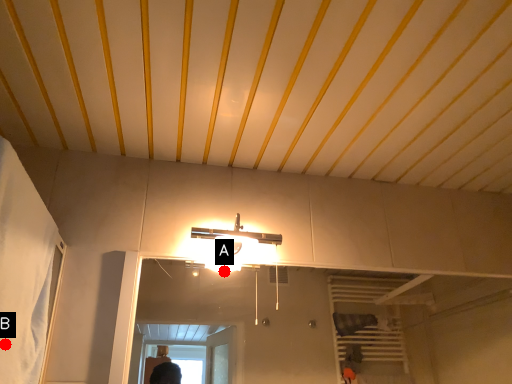
Question: Two points are circled on the image, labeled by A and B beside each circle. Which point is farther from the camera taking this photo?

Choices:
 (A) A is further
 (B) B is further

Answer: (A)